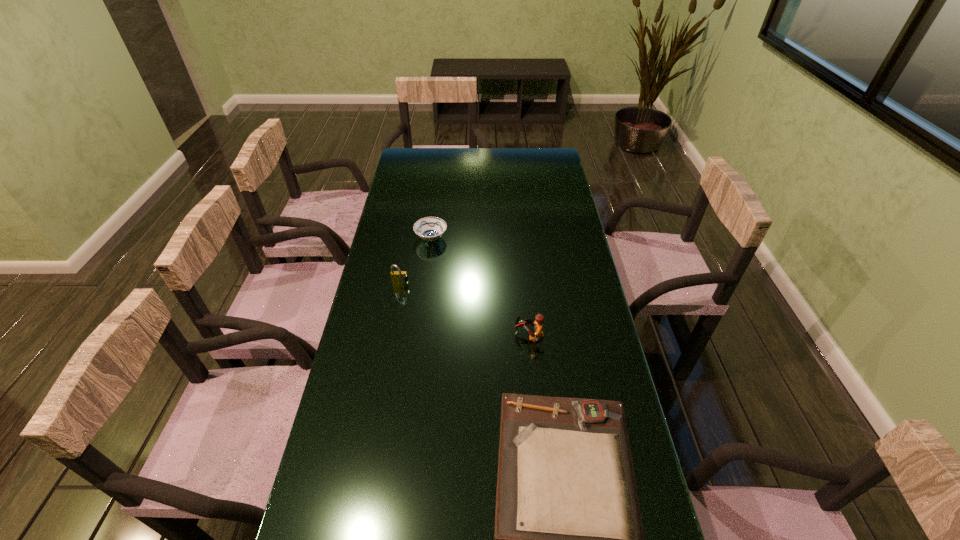
Identify which object is located as the second nearest to the second nearest object. Please provide its 2D coordinates. Your answer should be formatted as a tuple, i.e. [(x, y)], where the tuple contains the x and y coordinates of a point satisfying the conditions above.

[(398, 277)]

Image resolution: width=960 pixels, height=540 pixels. What are the coordinates of `object that is the third closest to the soup bowl` in the screenshot? It's located at (568, 539).